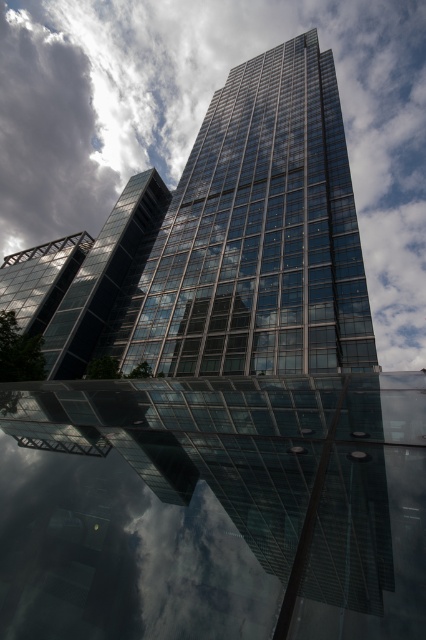
Question: Is transparent glass building at center smaller than white fluffy cloud at upper center?

Choices:
 (A) no
 (B) yes

Answer: (B)

Question: Which point is closer to the camera?

Choices:
 (A) transparent glass building at center
 (B) white fluffy cloud at upper center

Answer: (A)

Question: Among these objects, which one is farthest from the camera?

Choices:
 (A) transparent glass building at center
 (B) white fluffy cloud at upper center

Answer: (B)

Question: Is transparent glass building at center below white fluffy cloud at upper center?

Choices:
 (A) no
 (B) yes

Answer: (B)

Question: Can you confirm if transparent glass building at center is positioned below white fluffy cloud at upper center?

Choices:
 (A) yes
 (B) no

Answer: (A)